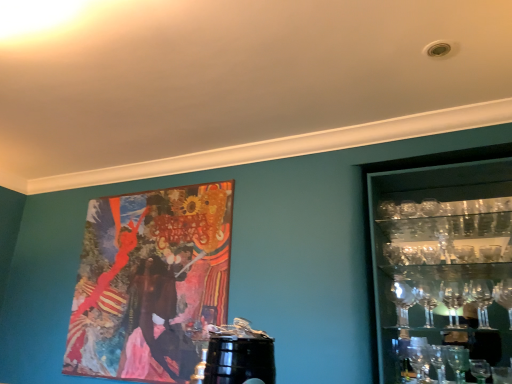
Question: Is wooden painting at upper left wider or thinner than clear glass shelves at right?

Choices:
 (A) thin
 (B) wide

Answer: (A)

Question: In terms of size, does wooden painting at upper left appear bigger or smaller than clear glass shelves at right?

Choices:
 (A) small
 (B) big

Answer: (A)

Question: From the image's perspective, relative to clear glass shelves at right, is wooden painting at upper left above or below?

Choices:
 (A) below
 (B) above

Answer: (A)

Question: From a real-world perspective, is clear glass shelves at right positioned above or below wooden painting at upper left?

Choices:
 (A) above
 (B) below

Answer: (B)

Question: Considering the positions of clear glass shelves at right and wooden painting at upper left in the image, is clear glass shelves at right taller or shorter than wooden painting at upper left?

Choices:
 (A) short
 (B) tall

Answer: (A)

Question: Choose the correct answer: Is clear glass shelves at right inside wooden painting at upper left or outside it?

Choices:
 (A) inside
 (B) outside

Answer: (B)

Question: In terms of width, does clear glass shelves at right look wider or thinner when compared to wooden painting at upper left?

Choices:
 (A) thin
 (B) wide

Answer: (B)